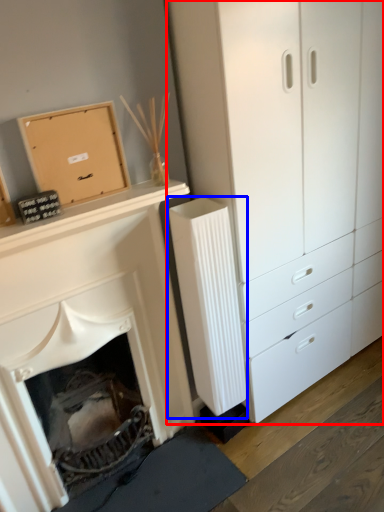
Question: Which object appears closest to the camera in this image, chest of drawers (highlighted by a red box) or radiator (highlighted by a blue box)?

Choices:
 (A) chest of drawers
 (B) radiator

Answer: (A)